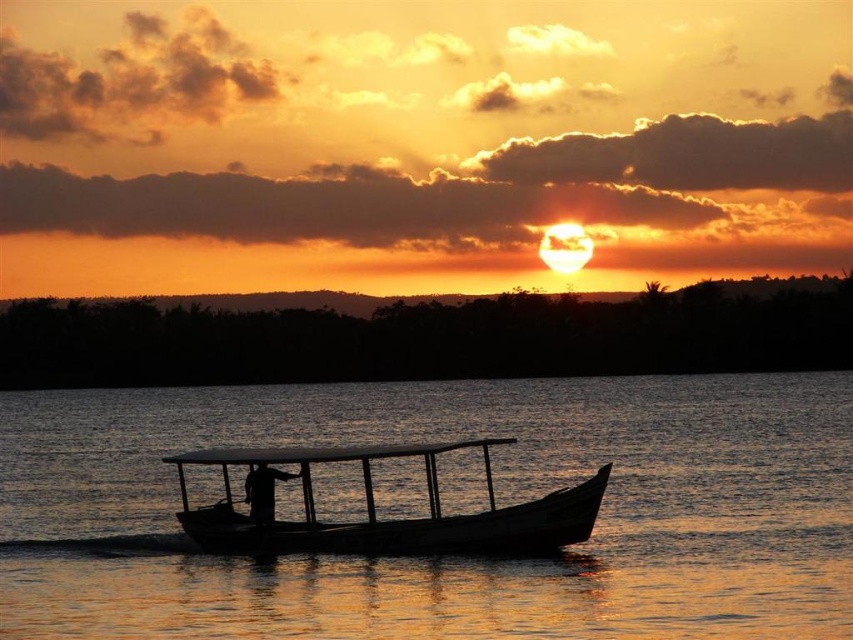
Question: Is transparent water at boat center below wooden boat at center?

Choices:
 (A) no
 (B) yes

Answer: (A)

Question: Does transparent water at boat center come in front of wooden boat at center?

Choices:
 (A) yes
 (B) no

Answer: (A)

Question: Which point is farther to the camera?

Choices:
 (A) transparent water at boat center
 (B) wooden boat at center

Answer: (B)

Question: Which of the following is the closest to the observer?

Choices:
 (A) (410, 570)
 (B) (257, 500)

Answer: (A)

Question: Can you confirm if transparent water at boat center is bigger than wooden boat at center?

Choices:
 (A) no
 (B) yes

Answer: (B)